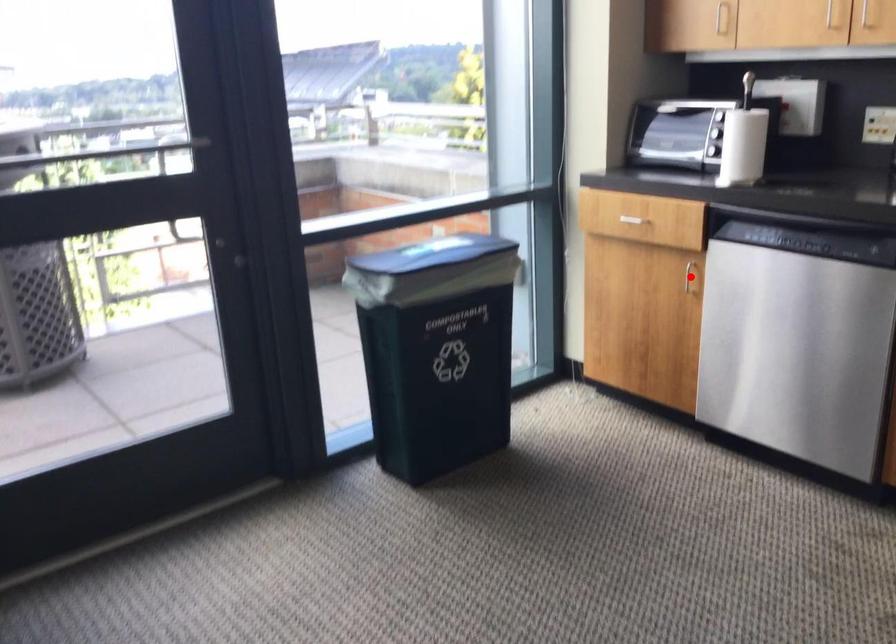
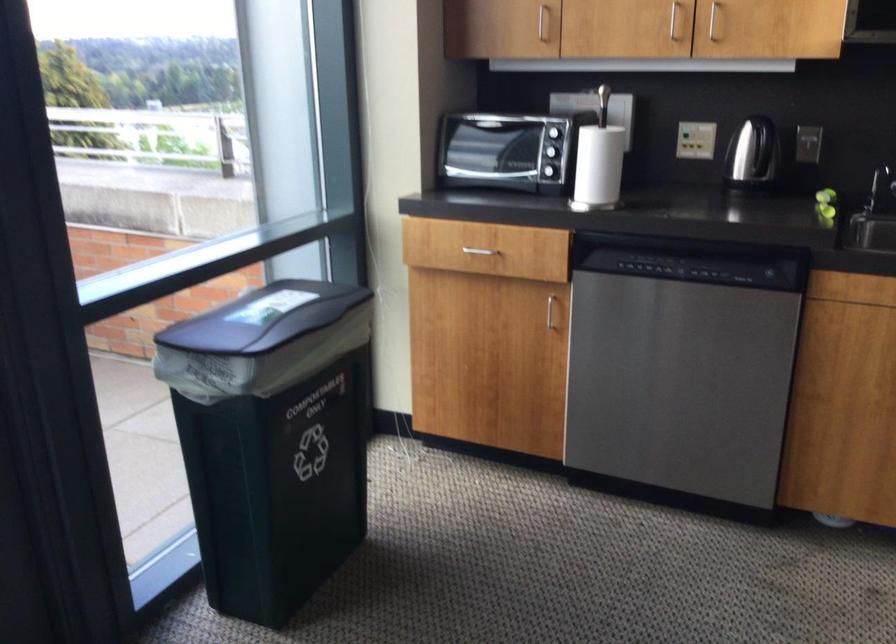
In the second image, find the point that corresponds to the highlighted location in the first image.

(549, 310)